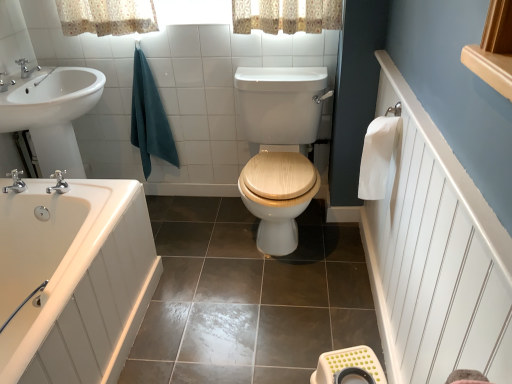
Locate an element on the screen. vacant area to the left of white plastic stool at lower right is located at coordinates (283, 365).